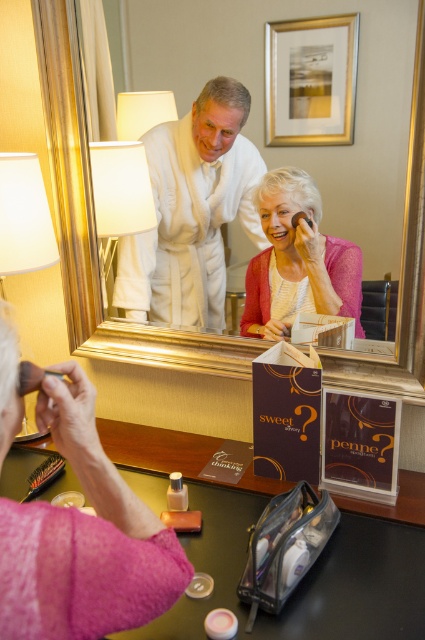
What do you see at coordinates (192, 212) in the screenshot? Image resolution: width=425 pixels, height=640 pixels. I see `white bathrobe at upper center` at bounding box center [192, 212].

Is point (218, 154) farther from camera compared to point (272, 320)?

No, it is not.

Does point (180, 282) come farther from viewer compared to point (263, 298)?

Yes.

Locate an element on the screen. white bathrobe at upper center is located at coordinates (192, 212).

Based on the photo, between pink fabric laugh at lower left and white fabric lampshade at upper left, which one is positioned higher?

white fabric lampshade at upper left is above.

Between point (8, 440) and point (135, 161), which one is positioned in front?

Point (8, 440)

Where is `pink fabric laugh at lower left`? The height and width of the screenshot is (640, 425). pink fabric laugh at lower left is located at coordinates (84, 538).

Is point (36, 582) positioned before point (59, 458)?

Yes, point (36, 582) is in front of point (59, 458).

Image resolution: width=425 pixels, height=640 pixels. In order to click on pink fabric laugh at lower left in this screenshot , I will do `click(84, 538)`.

This screenshot has height=640, width=425. I want to click on pink fabric laugh at lower left, so click(84, 538).